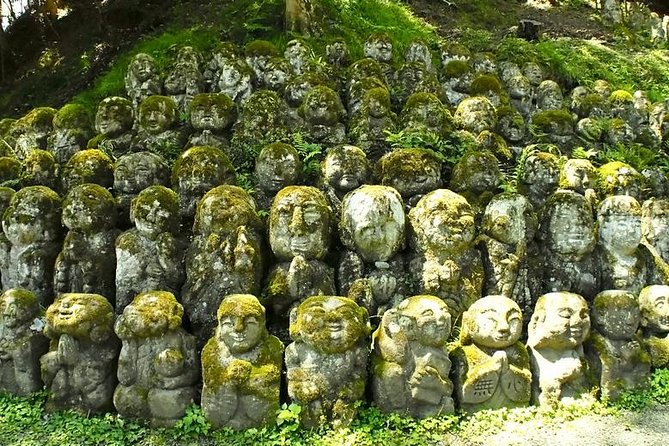
This screenshot has width=669, height=446. Find the location of `book`. book is located at coordinates (449, 368).